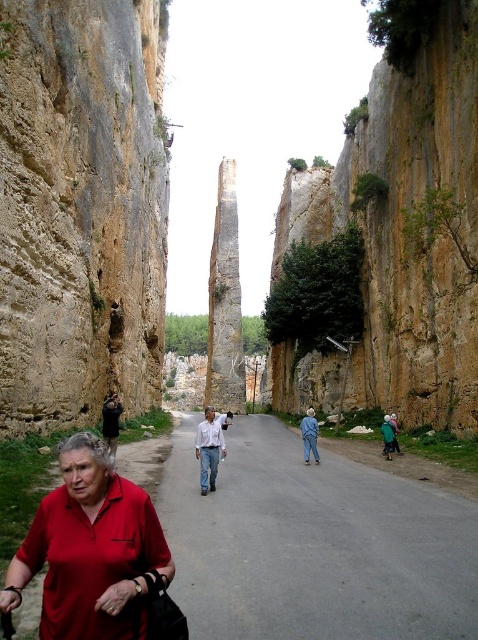
Question: Is smooth asphalt road at center to the right of light blue shirt at center from the viewer's perspective?

Choices:
 (A) yes
 (B) no

Answer: (A)

Question: Does smooth asphalt road at center have a larger size compared to blue denim jeans at center?

Choices:
 (A) yes
 (B) no

Answer: (B)

Question: Among these points, which one is farthest from the camera?

Choices:
 (A) (306, 433)
 (B) (108, 449)
 (C) (127, 604)
 (D) (423, 356)

Answer: (D)

Question: Can you confirm if smooth asphalt road at center is positioned to the left of blue denim jeans at center?

Choices:
 (A) yes
 (B) no

Answer: (A)

Question: Which of the following is the farthest from the observer?

Choices:
 (A) (202, 440)
 (B) (105, 404)

Answer: (B)

Question: Which of the following is the farthest from the observer?

Choices:
 (A) (108, 458)
 (B) (107, 444)
 (C) (239, 436)

Answer: (C)